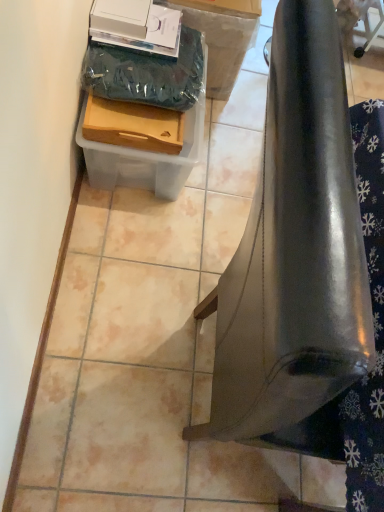
Where is `blank space to the left of glossy metallic bell at lower right`? The height and width of the screenshot is (512, 384). blank space to the left of glossy metallic bell at lower right is located at coordinates (124, 298).